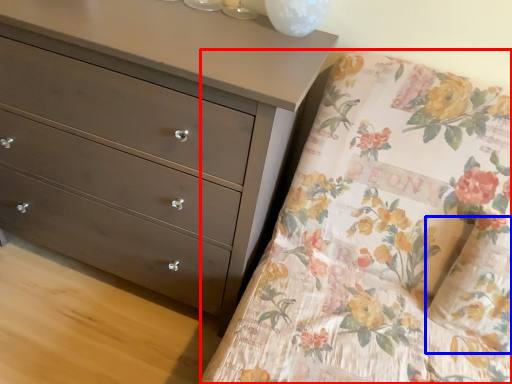
Question: Which point is further to the camera, mattress (highlighted by a red box) or pillow (highlighted by a blue box)?

Choices:
 (A) mattress
 (B) pillow

Answer: (B)